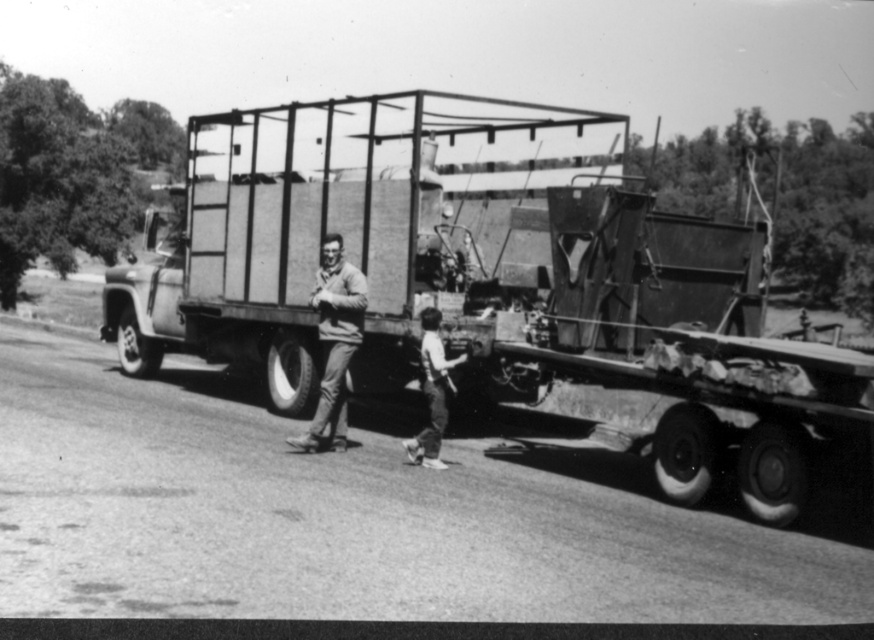
Question: Is smooth beige sweater at center in front of light brown hair at lower center?

Choices:
 (A) yes
 (B) no

Answer: (B)

Question: Does smooth beige sweater at center have a lesser width compared to light brown hair at lower center?

Choices:
 (A) yes
 (B) no

Answer: (B)

Question: Which object appears closest to the camera in this image?

Choices:
 (A) smooth beige sweater at center
 (B) light brown hair at lower center

Answer: (B)

Question: Is metallic flatbed truck at center to the right of light brown hair at lower center from the viewer's perspective?

Choices:
 (A) yes
 (B) no

Answer: (A)

Question: Which object is the closest to the metallic flatbed truck at center?

Choices:
 (A) light brown hair at lower center
 (B) smooth beige sweater at center

Answer: (B)

Question: Estimate the real-world distances between objects in this image. Which object is farther from the light brown hair at lower center?

Choices:
 (A) metallic flatbed truck at center
 (B) smooth beige sweater at center

Answer: (A)